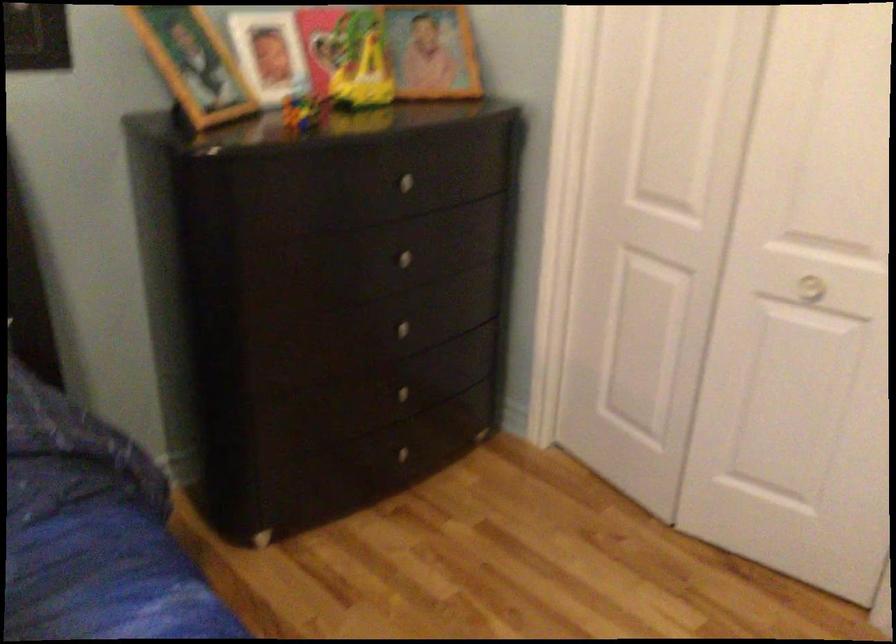
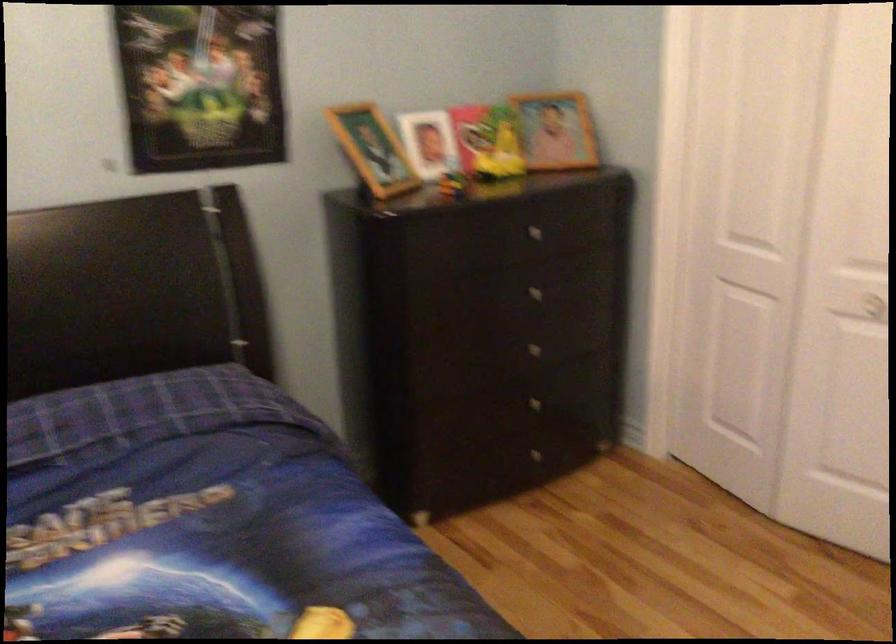
Where in the second image is the point corresponding to pixel 409 332 from the first image?

(539, 353)